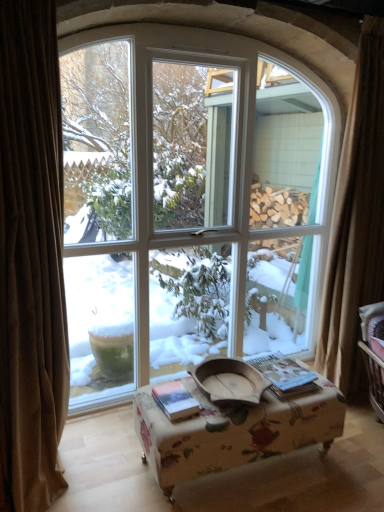
Question: Can we say white glass window at center lies outside brown curtain at right, which is the second curtain from front to back?

Choices:
 (A) yes
 (B) no

Answer: (A)

Question: Is white glass window at center in contact with brown curtain at right, which is the second curtain from front to back?

Choices:
 (A) no
 (B) yes

Answer: (A)

Question: Is the position of white glass window at center more distant than that of brown curtain at right, marked as the second curtain in a left-to-right arrangement?

Choices:
 (A) no
 (B) yes

Answer: (A)

Question: Can you confirm if white glass window at center is shorter than brown curtain at right, marked as the second curtain in a left-to-right arrangement?

Choices:
 (A) no
 (B) yes

Answer: (A)

Question: Is white glass window at center at the left side of brown curtain at right, which appears as the 1th curtain when viewed from the right?

Choices:
 (A) no
 (B) yes

Answer: (B)

Question: Can you confirm if white glass window at center is thinner than brown curtain at right, marked as the first curtain in a back-to-front arrangement?

Choices:
 (A) yes
 (B) no

Answer: (B)

Question: Considering the relative sizes of white glass window at center and hardcover book at center, the 2th book positioned from the left, in the image provided, is white glass window at center bigger than hardcover book at center, the 2th book positioned from the left,?

Choices:
 (A) no
 (B) yes

Answer: (B)

Question: Is white glass window at center positioned in front of hardcover book at center, the 2th book positioned from the left?

Choices:
 (A) no
 (B) yes

Answer: (B)

Question: Is white glass window at center wider than hardcover book at center, the 2th book positioned from the left?

Choices:
 (A) yes
 (B) no

Answer: (A)

Question: Would you say white glass window at center is outside hardcover book at center, acting as the first book starting from the right?

Choices:
 (A) yes
 (B) no

Answer: (A)

Question: Considering the relative sizes of white glass window at center and hardcover book at center, the 2th book positioned from the left, in the image provided, is white glass window at center thinner than hardcover book at center, the 2th book positioned from the left,?

Choices:
 (A) no
 (B) yes

Answer: (A)

Question: From a real-world perspective, is white glass window at center on hardcover book at center, the 2th book positioned from the left?

Choices:
 (A) no
 (B) yes

Answer: (B)

Question: Is hardcover book at center, the 2th book in the right-to-left sequence, taller than brown curtain at right, marked as the second curtain in a left-to-right arrangement?

Choices:
 (A) yes
 (B) no

Answer: (B)